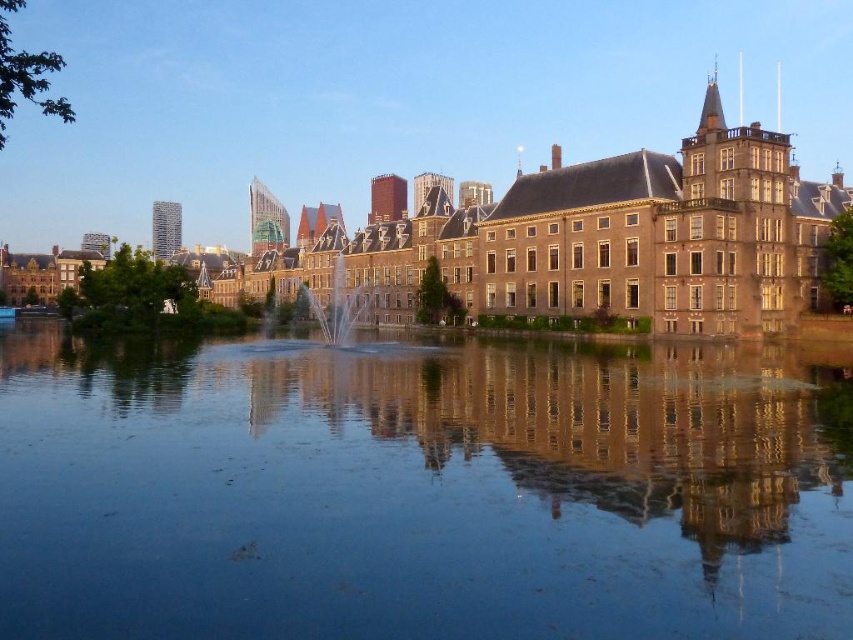
You are standing at the edge of the water and see the brown stone building at center and the clear glass fountain at center. Which one is positioned to the right side from your perspective?

The brown stone building at center is positioned to the right of the clear glass fountain at center, so it is the one on the right side from your perspective.

You are a city planner evaluating the urban space. Considering the brown stone building at center and the clear glass fountain at center, which one would cast a longer shadow at noon on a sunny day?

The brown stone building at center is taller than the clear glass fountain at center, so it would cast a longer shadow at noon on a sunny day.

You are standing at the point labeled as point (416, 493) in the image. What do you see directly beneath your feet?

You see smooth reflective water at center directly beneath your feet at point (416, 493).